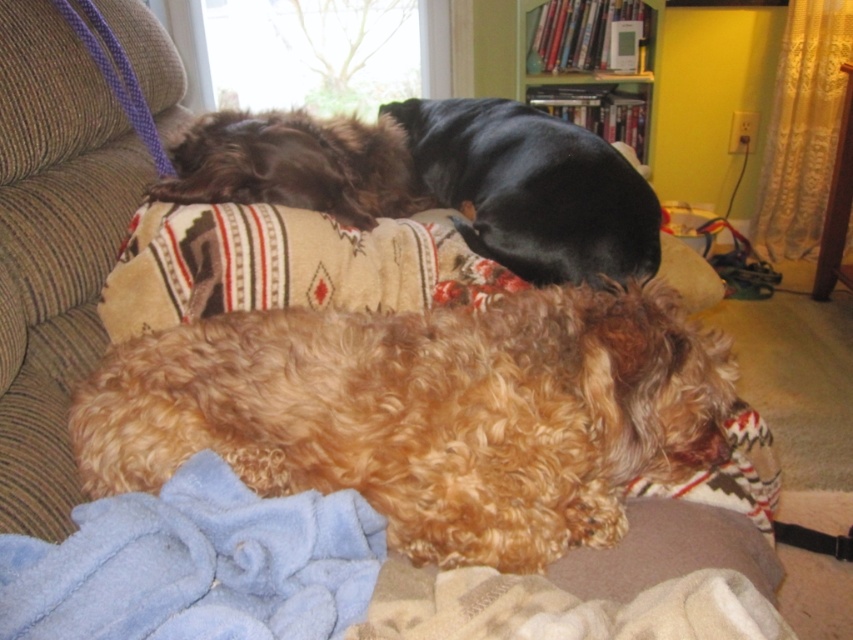
Question: Estimate the real-world distances between objects in this image. Which object is closer to the black smooth dog at upper center?

Choices:
 (A) fuzzy brown dog at center
 (B) wooden bookshelf at upper center

Answer: (A)

Question: Among these objects, which one is farthest from the camera?

Choices:
 (A) black smooth dog at upper center
 (B) shaggy brown dog at upper center

Answer: (A)

Question: Can you confirm if fuzzy brown dog at center is smaller than black smooth dog at upper center?

Choices:
 (A) no
 (B) yes

Answer: (B)

Question: Can you confirm if fuzzy brown dog at center is positioned to the right of shaggy brown dog at upper center?

Choices:
 (A) no
 (B) yes

Answer: (B)

Question: Considering the real-world distances, which object is closest to the wooden bookshelf at upper center?

Choices:
 (A) fuzzy brown dog at center
 (B) black smooth dog at upper center
 (C) shaggy brown dog at upper center

Answer: (B)

Question: Does fuzzy brown dog at center have a lesser width compared to shaggy brown dog at upper center?

Choices:
 (A) no
 (B) yes

Answer: (A)